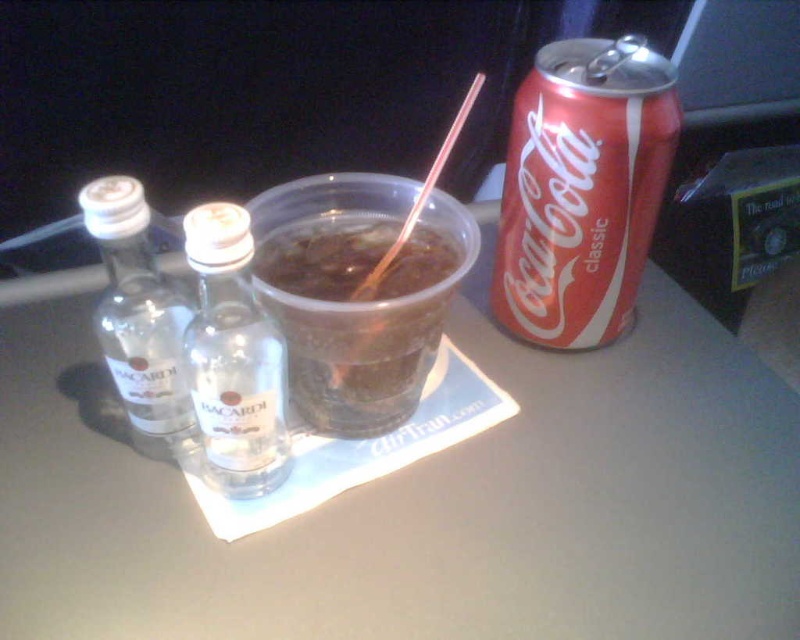
Question: Which point is farther to the camera?

Choices:
 (A) clear glass bottle at left
 (B) clear plastic table at center

Answer: (B)

Question: Which is nearer to the translucent plastic cup at center?

Choices:
 (A) red matte coca-cola can at right
 (B) clear plastic table at center

Answer: (A)

Question: From the image, what is the correct spatial relationship of clear plastic table at center in relation to clear glass bottle at center?

Choices:
 (A) right
 (B) left

Answer: (A)

Question: Does red matte coca-cola can at right appear over translucent plastic cup at center?

Choices:
 (A) yes
 (B) no

Answer: (A)

Question: Among these objects, which one is farthest from the camera?

Choices:
 (A) clear plastic table at center
 (B) translucent plastic cup at center
 (C) clear glass bottle at left

Answer: (B)

Question: Does translucent plastic cup at center appear under clear glass bottle at left?

Choices:
 (A) no
 (B) yes

Answer: (A)